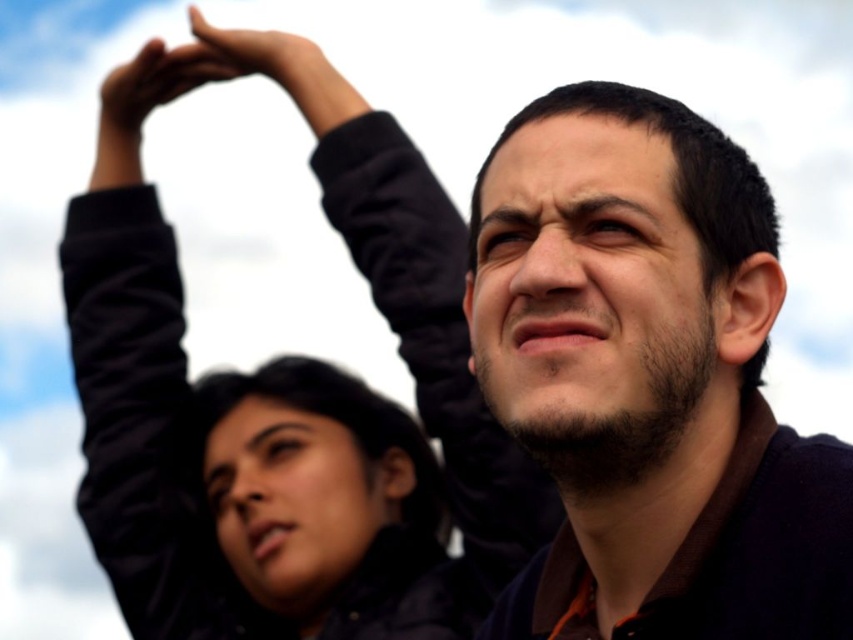
Does point (163, 305) come in front of point (256, 72)?

No, it is behind (256, 72).

Which is above, black fabric arm at upper left or matte black hand at upper center?

Positioned higher is matte black hand at upper center.

Is point (102, 186) behind point (202, 58)?

Yes, point (102, 186) is farther from viewer.

The width and height of the screenshot is (853, 640). What are the coordinates of `black fabric arm at upper left` in the screenshot? It's located at (137, 369).

Can you confirm if dark brown sweater at upper right is shorter than matte black hand at upper center?

In fact, dark brown sweater at upper right may be taller than matte black hand at upper center.

Does dark brown sweater at upper right appear over matte black hand at upper center?

No, dark brown sweater at upper right is not above matte black hand at upper center.

Who is more distant from viewer, [654,148] or [317,80]?

The point [317,80] is more distant.

Find the location of `dark brown sweater at upper right`. dark brown sweater at upper right is located at coordinates (648, 376).

Describe the element at coordinates (648, 376) in the screenshot. The height and width of the screenshot is (640, 853). I see `dark brown sweater at upper right` at that location.

Does dark brown sweater at upper right have a greater width compared to matte black jacket at upper center?

Incorrect, dark brown sweater at upper right's width does not surpass matte black jacket at upper center's.

The width and height of the screenshot is (853, 640). Describe the element at coordinates (648, 376) in the screenshot. I see `dark brown sweater at upper right` at that location.

The height and width of the screenshot is (640, 853). Find the location of `dark brown sweater at upper right`. dark brown sweater at upper right is located at coordinates (648, 376).